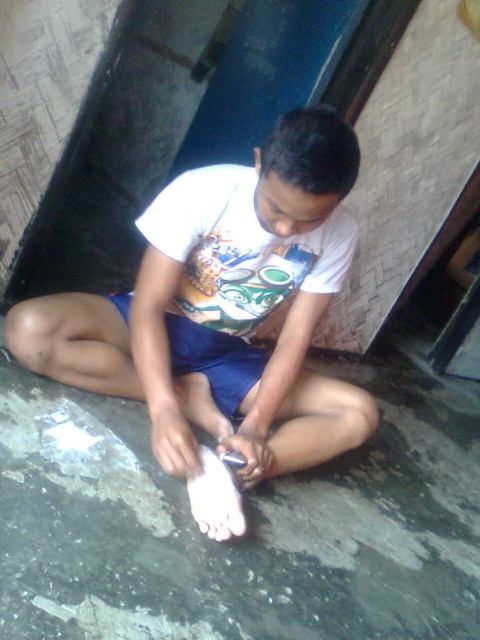
Question: Which point appears farthest from the camera in this image?

Choices:
 (A) (471, 488)
 (B) (216, 528)

Answer: (A)

Question: Is shiny gray cement at lower center thinner than white matte shirt at center?

Choices:
 (A) no
 (B) yes

Answer: (A)

Question: Can you confirm if shiny gray cement at lower center is bigger than white matte shirt at center?

Choices:
 (A) no
 (B) yes

Answer: (B)

Question: Among these objects, which one is nearest to the camera?

Choices:
 (A) white matte shirt at center
 (B) shiny gray cement at lower center

Answer: (B)

Question: From the image, what is the correct spatial relationship of shiny gray cement at lower center in relation to white matte shirt at center?

Choices:
 (A) below
 (B) above

Answer: (A)

Question: Which of the following is the farthest from the observer?

Choices:
 (A) (145, 275)
 (B) (471, 426)

Answer: (B)